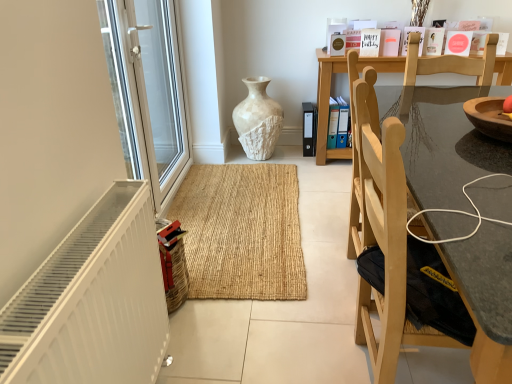
Question: Is white matte radiator at lower left located outside white textured vase at center?

Choices:
 (A) no
 (B) yes

Answer: (B)

Question: From the image's perspective, is white matte radiator at lower left located beneath white textured vase at center?

Choices:
 (A) no
 (B) yes

Answer: (B)

Question: Is white matte radiator at lower left shorter than white textured vase at center?

Choices:
 (A) yes
 (B) no

Answer: (B)

Question: Is white matte radiator at lower left bigger than white textured vase at center?

Choices:
 (A) no
 (B) yes

Answer: (A)

Question: Are white matte radiator at lower left and white textured vase at center beside each other?

Choices:
 (A) no
 (B) yes

Answer: (A)

Question: Does white matte radiator at lower left have a greater height compared to white textured vase at center?

Choices:
 (A) yes
 (B) no

Answer: (A)

Question: Is white glossy screen door at left completely or partially inside light wood chair at right?

Choices:
 (A) yes
 (B) no

Answer: (B)

Question: Is light wood chair at right looking in the opposite direction of white glossy screen door at left?

Choices:
 (A) no
 (B) yes

Answer: (A)

Question: Is light wood chair at right in contact with white glossy screen door at left?

Choices:
 (A) no
 (B) yes

Answer: (A)

Question: Is light wood chair at right positioned before white glossy screen door at left?

Choices:
 (A) no
 (B) yes

Answer: (B)

Question: Would you say light wood chair at right is outside white glossy screen door at left?

Choices:
 (A) no
 (B) yes

Answer: (B)

Question: Would you say light wood chair at right is a long distance from white glossy screen door at left?

Choices:
 (A) yes
 (B) no

Answer: (A)

Question: Can you confirm if white glossy screen door at left is positioned to the right of white matte radiator at lower left?

Choices:
 (A) no
 (B) yes

Answer: (A)